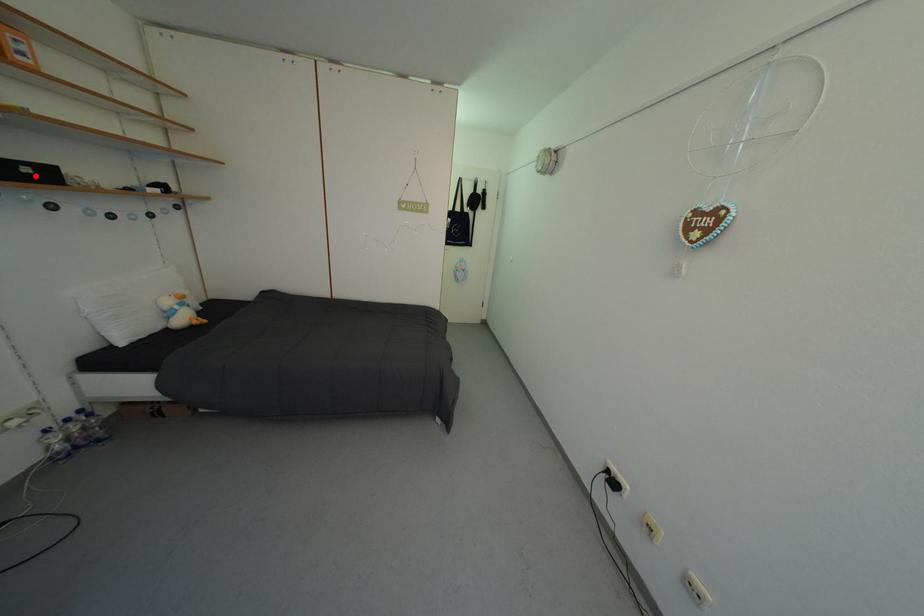
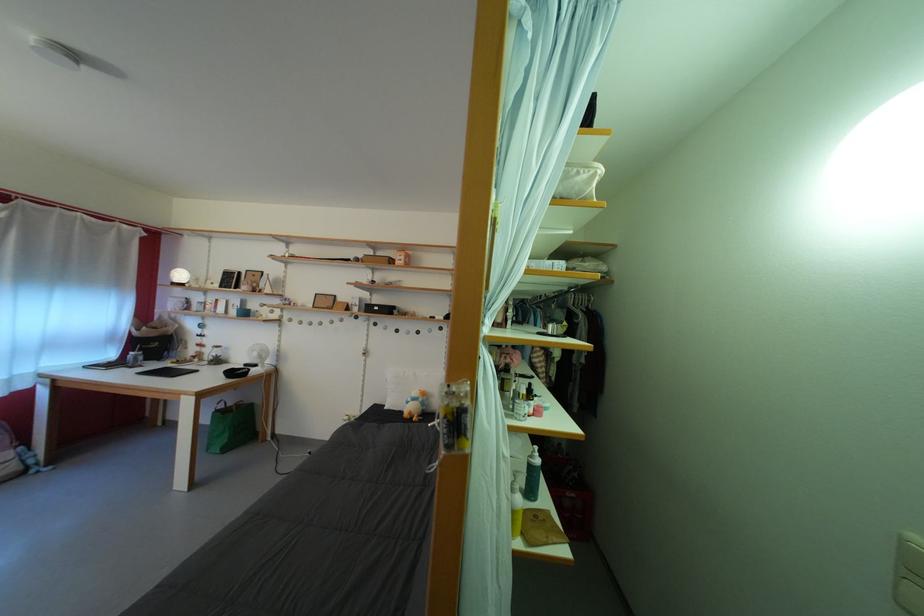
Question: A red point is marked in image1. In image2, is the corresponding 3D point closer to the camera or farther? Reply with the corresponding letter.

Choices:
 (A) The corresponding 3D point is closer.
 (B) The corresponding 3D point is farther.

Answer: (A)